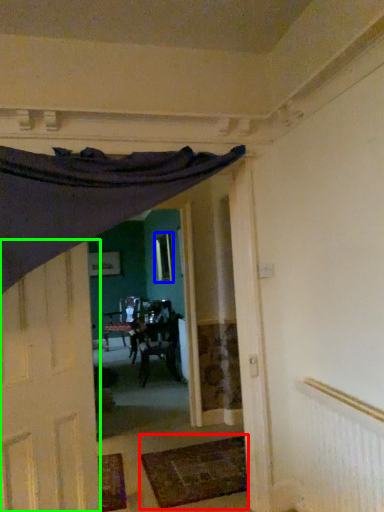
Question: Which object is positioned closest to mat (highlighted by a red box)? Select from window (highlighted by a blue box) and door (highlighted by a green box).

Choices:
 (A) window
 (B) door

Answer: (B)